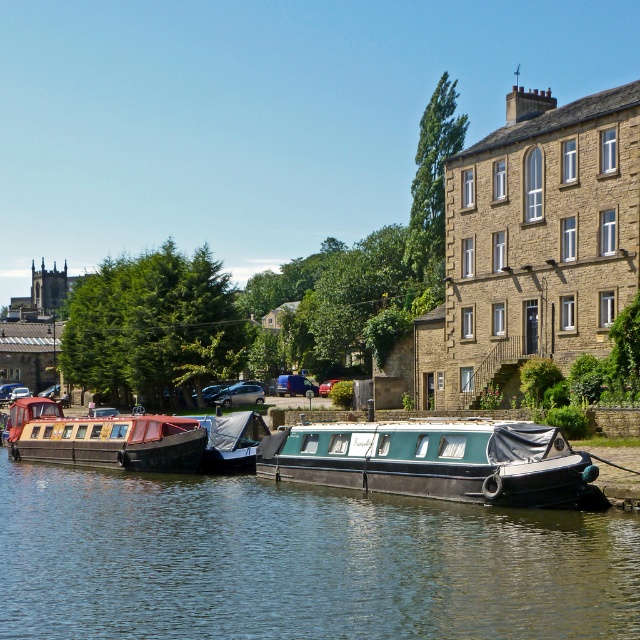
You are planning to take a short boat ride on the river. You have to choose between the green rubber boat at center and the teal matte boat at center. Which one can carry more people?

The green rubber boat at center has a larger size compared to teal matte boat at center, so it can carry more people.

You are standing on the riverside and want to take a photo of the teal matte boat at center. If your camera can focus on objects up to 50 meters away, will you need to move closer to get a clear shot?

The teal matte boat at center is 54.88 meters from viewer, which is beyond the camera focus range of 50 meters. You need to move closer to ensure the boat is within the focus range.

From the picture: You are a delivery drone that needs to land between the teal matte boat at center and the blue tarpaulin boat at center. The minimum safe distance required for landing is 10 meters. Can you safely land between them?

The teal matte boat at center and blue tarpaulin boat at center are 9.04 meters apart from each other, which is less than the required 10 meters for safe landing. Therefore, the drone cannot safely land between them.